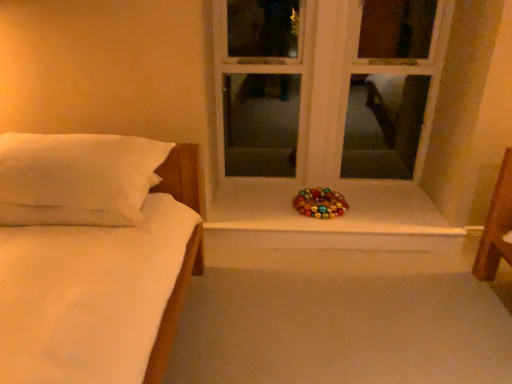
This screenshot has width=512, height=384. I want to click on metallic shiny wreath at center, so click(331, 230).

What do you see at coordinates (77, 178) in the screenshot? Image resolution: width=512 pixels, height=384 pixels. I see `white soft pillow at left` at bounding box center [77, 178].

Identify the location of metallic shiny wreath at center. Image resolution: width=512 pixels, height=384 pixels. (331, 230).

From the image's perspective, relative to metallic shiny wreath at center, is white wood window at center above or below?

white wood window at center is above metallic shiny wreath at center.

Is white wood window at center bigger than metallic shiny wreath at center?

Yes, white wood window at center is bigger than metallic shiny wreath at center.

Is white wood window at center completely or partially outside of metallic shiny wreath at center?

Yes, white wood window at center is not within metallic shiny wreath at center.

Is white soft pillow at left next to metallic shiny wreath at center and touching it?

white soft pillow at left is not next to metallic shiny wreath at center, and they're not touching.

Considering the sizes of objects white soft pillow at left and metallic shiny wreath at center in the image provided, who is shorter, white soft pillow at left or metallic shiny wreath at center?

metallic shiny wreath at center is shorter.

Is white soft pillow at left not inside metallic shiny wreath at center?

Yes, white soft pillow at left is outside of metallic shiny wreath at center.

In terms of size, does white soft pillow at left appear bigger or smaller than white wood window at center?

white soft pillow at left is smaller than white wood window at center.

From a real-world perspective, which object rests below the other?

From a 3D spatial view, white soft pillow at left is below.

Between white soft pillow at left and white wood window at center, which one has less height?

Standing shorter between the two is white soft pillow at left.

Is white soft pillow at left looking in the opposite direction of white wood window at center?

No.

At what (x,y) coordinates should I click in order to perform the action: click on window sill below the white wood window at center (from a real-world perspective). Please return your answer as a coordinate pair (x, y). The width and height of the screenshot is (512, 384). Looking at the image, I should click on (331, 230).

From a real-world perspective, is metallic shiny wreath at center physically located above or below white wood window at center?

In terms of real-world spatial position, metallic shiny wreath at center is below white wood window at center.

Which object is closer to the camera, metallic shiny wreath at center or white wood window at center?

white wood window at center is in front.

Can we say white wood window at center lies outside white soft pillow at left?

Yes.

From a real-world perspective, is white wood window at center over white soft pillow at left?

Yes, from a real-world perspective, white wood window at center is on top of white soft pillow at left.

Which object is positioned more to the right, white wood window at center or white soft pillow at left?

A: From the viewer's perspective, white wood window at center appears more on the right side.

From their relative heights in the image, would you say white wood window at center is taller or shorter than white soft pillow at left?

Clearly, white wood window at center is taller compared to white soft pillow at left.

Considering the positions of point (415, 191) and point (102, 147), is point (415, 191) closer or farther from the camera than point (102, 147)?

Point (415, 191) is farther from the camera than point (102, 147).

Is metallic shiny wreath at center looking in the opposite direction of white soft pillow at left?

That's not correct — metallic shiny wreath at center is not looking away from white soft pillow at left.

In terms of width, does metallic shiny wreath at center look wider or thinner when compared to white soft pillow at left?

Clearly, metallic shiny wreath at center has less width compared to white soft pillow at left.

Is metallic shiny wreath at center next to white soft pillow at left and touching it?

No, metallic shiny wreath at center is not beside white soft pillow at left.

Find the location of `window sill that is on the right side of white wood window at center`. window sill that is on the right side of white wood window at center is located at coordinates (331, 230).

Identify the location of pillow in front of the metallic shiny wreath at center. (77, 178).

Estimate the real-world distances between objects in this image. Which object is closer to white wood window at center, white soft pillow at left or metallic shiny wreath at center?

metallic shiny wreath at center is closer to white wood window at center.

Which object lies nearer to the anchor point metallic shiny wreath at center, white wood window at center or white soft pillow at left?

white wood window at center is positioned closer to the anchor metallic shiny wreath at center.

Considering their positions, is metallic shiny wreath at center positioned closer to white soft pillow at left than white wood window at center?

The object closer to white soft pillow at left is metallic shiny wreath at center.

Looking at the image, which one is located further to white wood window at center, metallic shiny wreath at center or white soft pillow at left?

white soft pillow at left is further to white wood window at center.

Estimate the real-world distances between objects in this image. Which object is further from metallic shiny wreath at center, white soft pillow at left or white wood window at center?

white soft pillow at left.

In the scene shown: When comparing their distances from white soft pillow at left, does white wood window at center or metallic shiny wreath at center seem closer?

Based on the image, metallic shiny wreath at center appears to be nearer to white soft pillow at left.

The height and width of the screenshot is (384, 512). I want to click on window between white soft pillow at left and metallic shiny wreath at center from left to right, so click(327, 86).